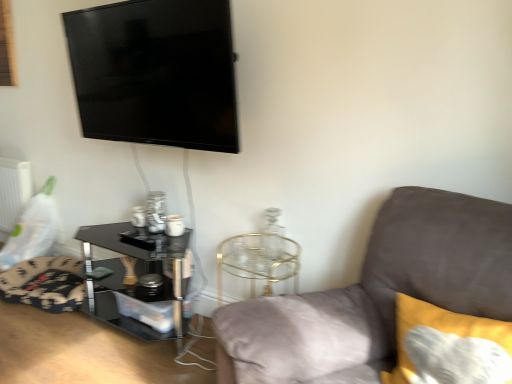
I want to click on vacant space in front of black glass table at lower left, so click(97, 361).